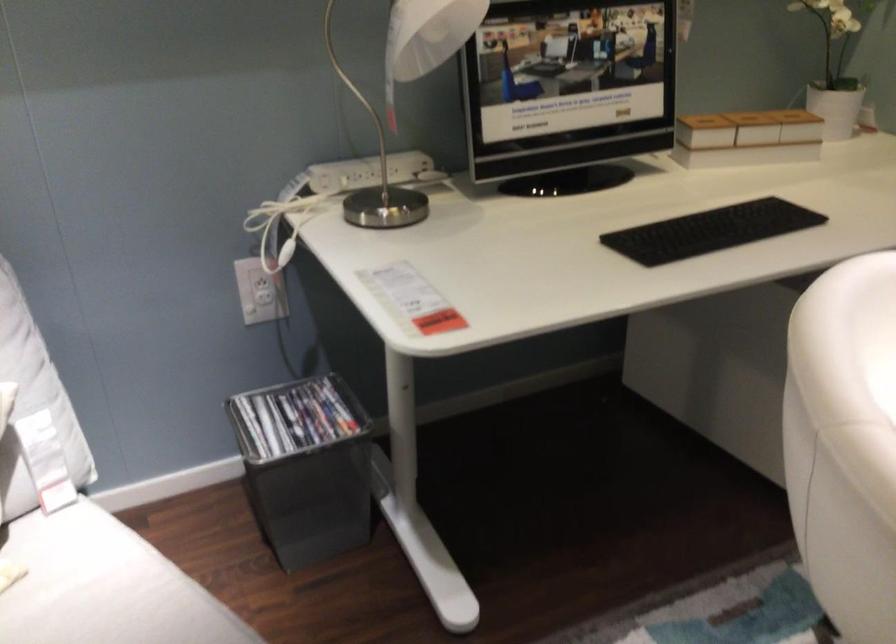
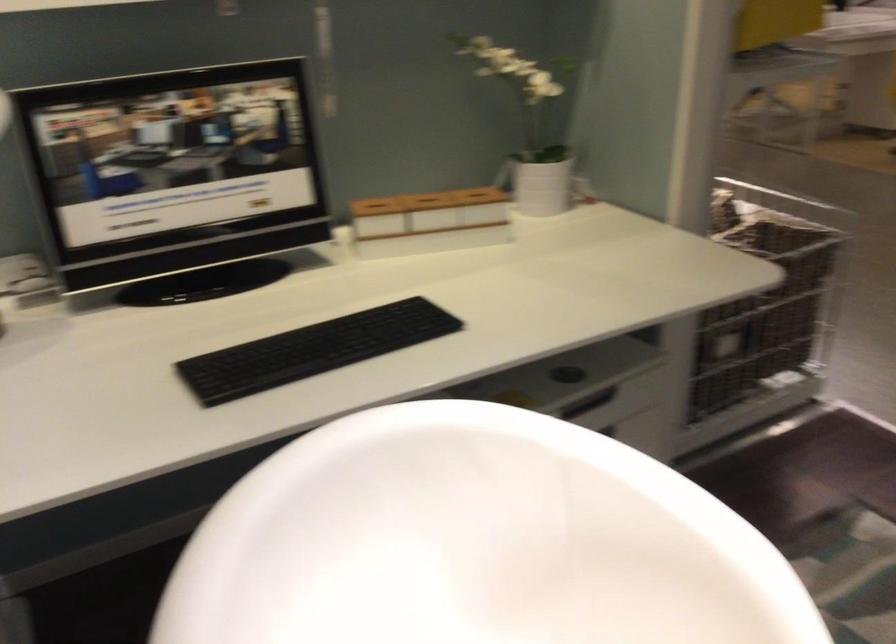
In the second image, find the point that corresponds to the point at 710,232 in the first image.

(313, 350)